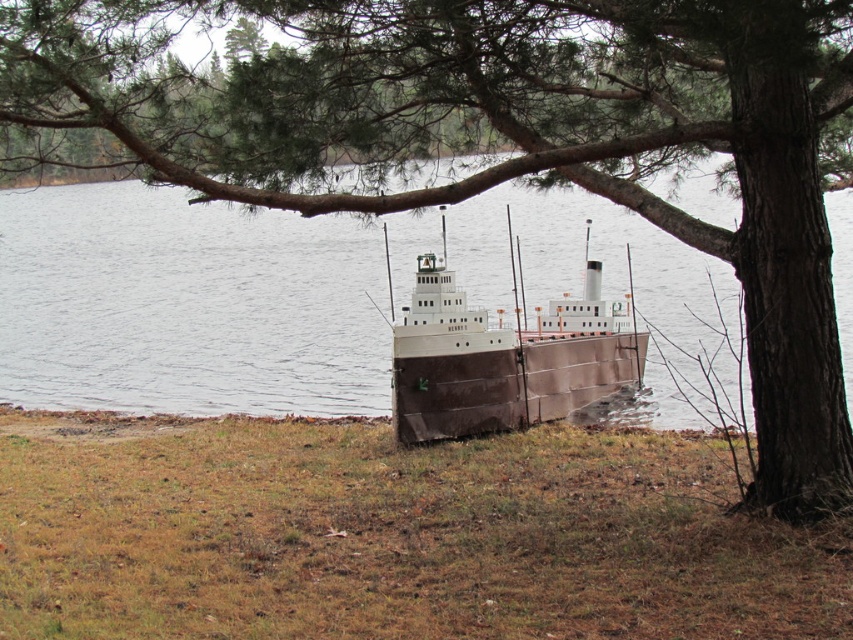
You are standing at the edge of the grassy bank near the model ship. You want to walk to the point marked at coordinates point (329, 444). How far will you have to walk to reach that point?

The point (329, 444) is 14.15 meters away from the viewer, so you will have to walk 14.15 meters to reach it.

You are standing in front of the model ship on the grassy bank. There are two points marked in the scene, point (450, 522) and point (560, 372). Which point is closer to you?

Point (450, 522) is closer to the viewer than point (560, 372).

You are a photographer wanting to capture the brown matte ship at center and the brown grass at lower center in a single shot. Which object will occupy more horizontal space in the photo?

The brown grass at lower center will occupy more horizontal space in the photo since its width surpasses that of the brown matte ship at center.